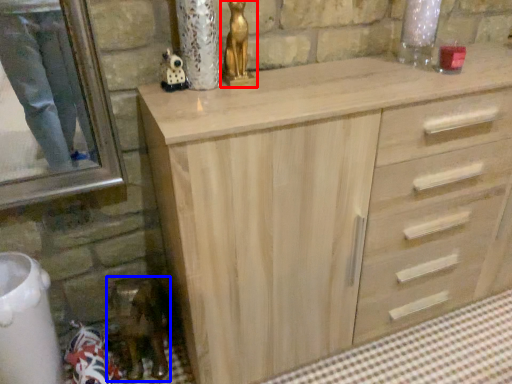
Question: Which object is closer to the camera taking this photo, sculpture (highlighted by a red box) or miniature (highlighted by a blue box)?

Choices:
 (A) sculpture
 (B) miniature

Answer: (A)